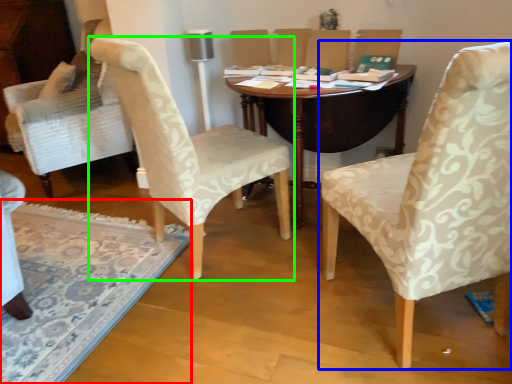
Question: Considering the real-world distances, which object is farthest from mat (highlighted by a red box)? chair (highlighted by a blue box) or chair (highlighted by a green box)?

Choices:
 (A) chair
 (B) chair

Answer: (A)